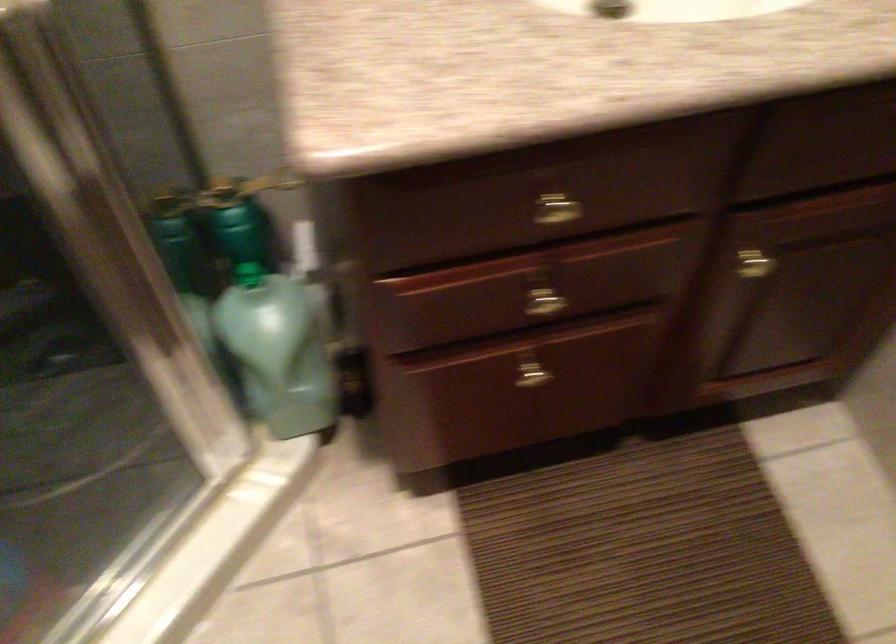
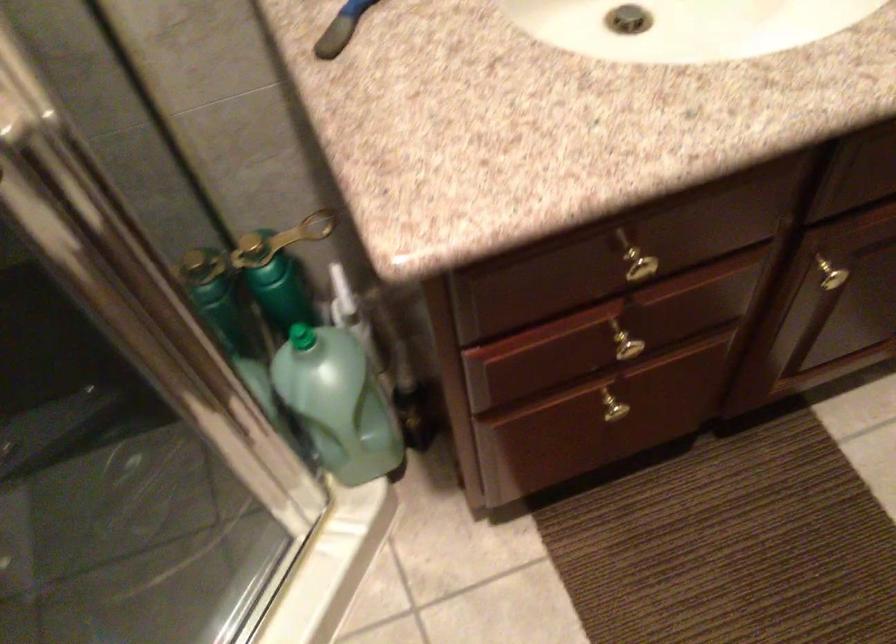
The point at (244,185) is marked in the first image. Where is the corresponding point in the second image?

(280, 240)